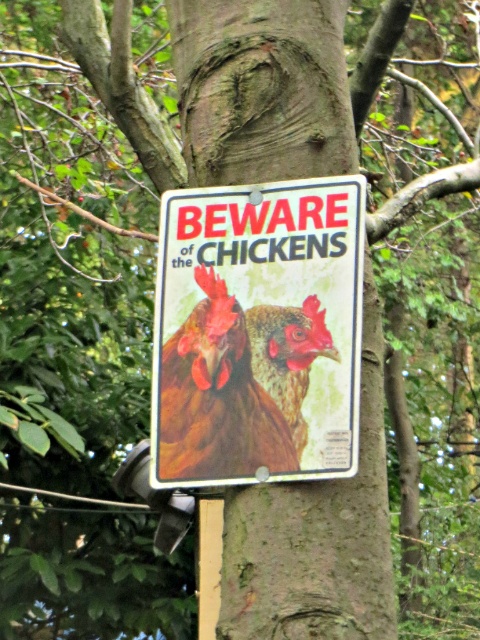
Looking at this image, is brown feathered chicken at center to the right of brown matte chicken at center from the viewer's perspective?

Incorrect, brown feathered chicken at center is not on the right side of brown matte chicken at center.

Can you confirm if brown feathered chicken at center is smaller than brown matte chicken at center?

Actually, brown feathered chicken at center might be larger than brown matte chicken at center.

Between point (216, 310) and point (323, 326), which one is positioned behind?

Point (216, 310)

The height and width of the screenshot is (640, 480). What are the coordinates of `brown feathered chicken at center` in the screenshot? It's located at (216, 396).

Which is in front, point (182, 444) or point (169, 406)?

Point (182, 444) is in front.

Is metallic signboard at center positioned behind brown feathered chicken at center?

No, it is in front of brown feathered chicken at center.

Between point (259, 349) and point (193, 465), which one is positioned in front?

Positioned in front is point (259, 349).

This screenshot has height=640, width=480. I want to click on metallic signboard at center, so click(257, 332).

Between metallic signboard at center and brown matte chicken at center, which one is positioned higher?

metallic signboard at center is higher up.

Does point (284, 390) lie in front of point (292, 353)?

That is True.

Image resolution: width=480 pixels, height=640 pixels. What do you see at coordinates (257, 332) in the screenshot?
I see `metallic signboard at center` at bounding box center [257, 332].

Locate an element on the screen. The height and width of the screenshot is (640, 480). metallic signboard at center is located at coordinates (257, 332).